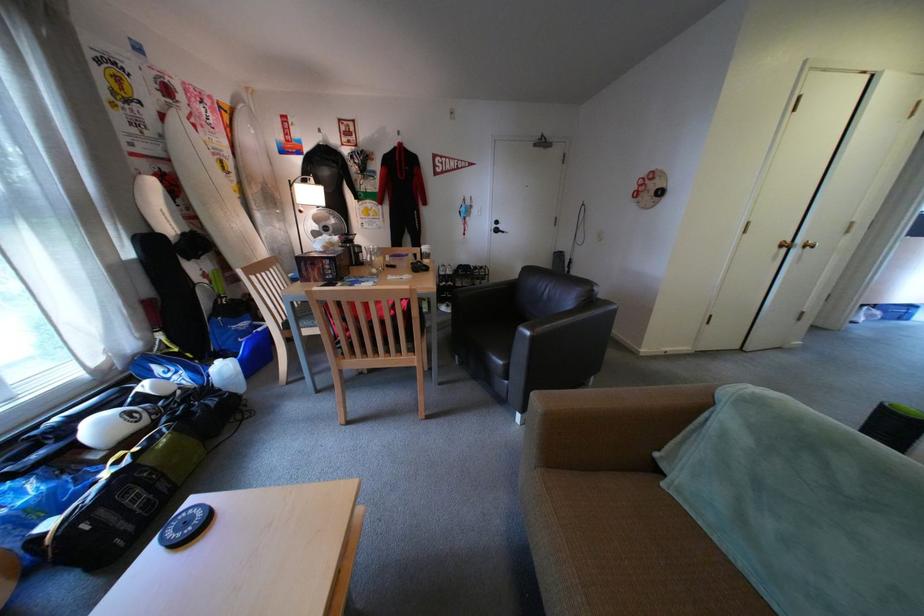
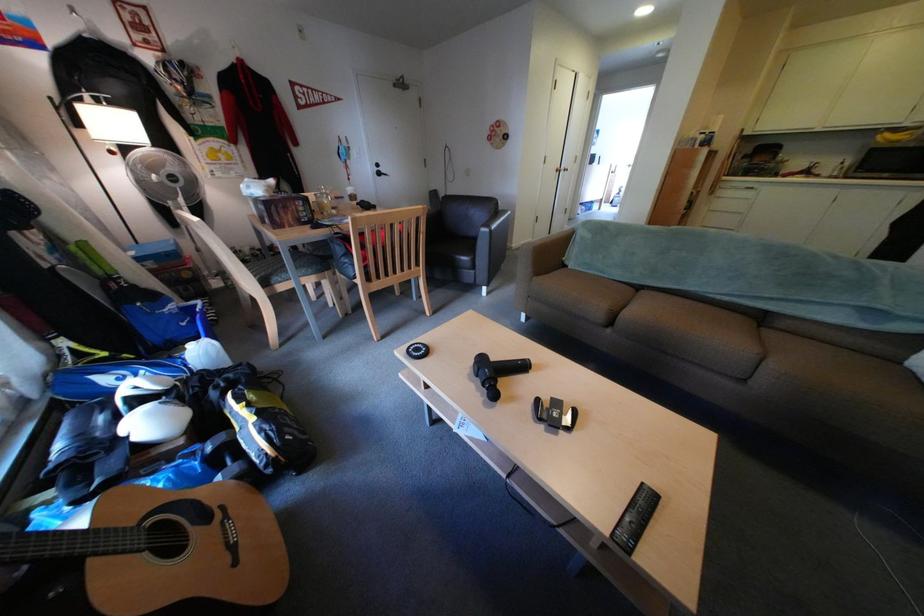
Locate, in the second image, the point that corresponds to (x=530, y=422) in the first image.

(496, 296)